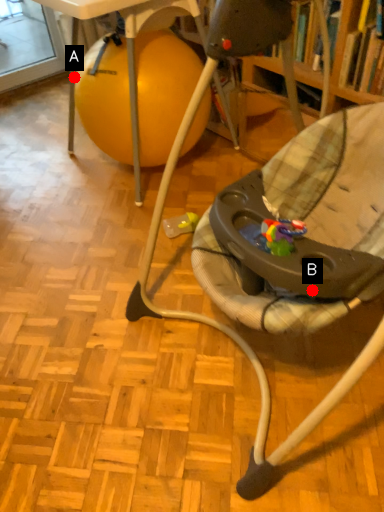
Question: Two points are circled on the image, labeled by A and B beside each circle. Which point is closer to the camera?

Choices:
 (A) A is closer
 (B) B is closer

Answer: (B)